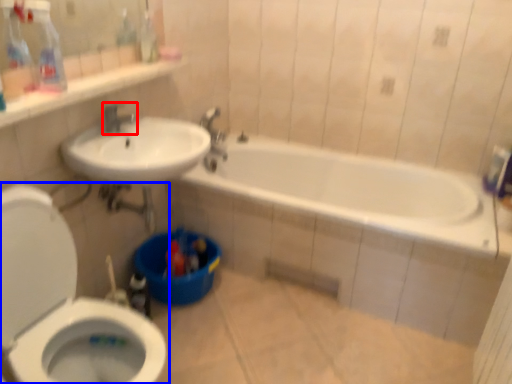
Question: Which point is further to the camera, tap (highlighted by a red box) or toilet (highlighted by a blue box)?

Choices:
 (A) tap
 (B) toilet

Answer: (A)